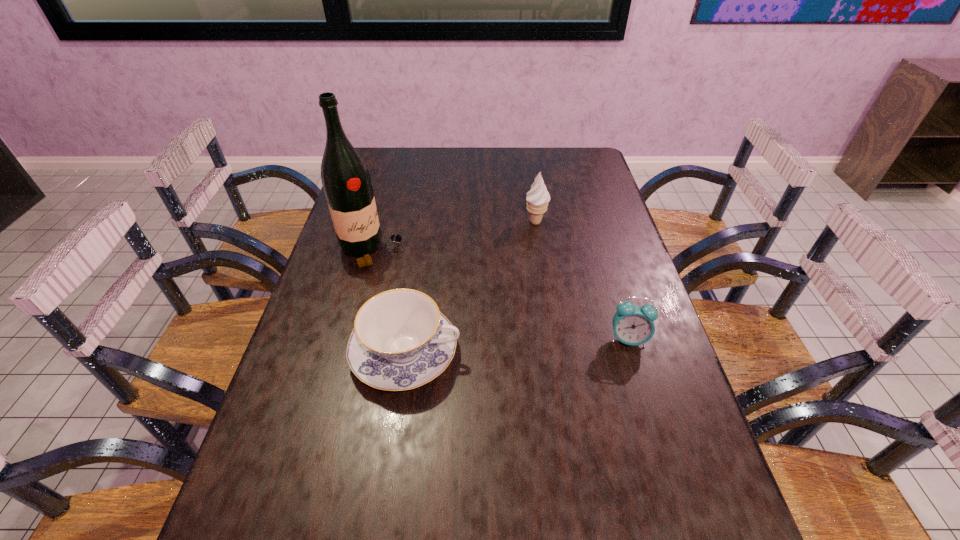
Find the location of a particular element. free point at the right edge is located at coordinates (641, 279).

Locate an element on the screen. vacant space at the far left corner of the desktop is located at coordinates (388, 151).

In the image, there is a desktop. In order to click on vacant space at the far right corner in this screenshot , I will do `click(586, 168)`.

I want to click on vacant area that lies between the tallest object and the second object from right to left, so click(x=454, y=237).

The height and width of the screenshot is (540, 960). I want to click on vacant point located between the wine bottle and the rightmost object, so click(x=500, y=295).

This screenshot has height=540, width=960. Find the location of `free space between the chinaware and the alarm clock`. free space between the chinaware and the alarm clock is located at coordinates pyautogui.click(x=516, y=346).

At what (x,y) coordinates should I click in order to perform the action: click on empty location between the rightmost object and the chinaware. Please return your answer as a coordinate pair (x, y). The width and height of the screenshot is (960, 540). Looking at the image, I should click on (516, 346).

Where is `free space between the alarm clock and the farthest object`? free space between the alarm clock and the farthest object is located at coordinates (582, 280).

The image size is (960, 540). I want to click on free area in between the icecream and the tallest object, so pyautogui.click(x=454, y=237).

Find the location of `free space between the third object from left to right and the rightmost object`. free space between the third object from left to right and the rightmost object is located at coordinates (582, 280).